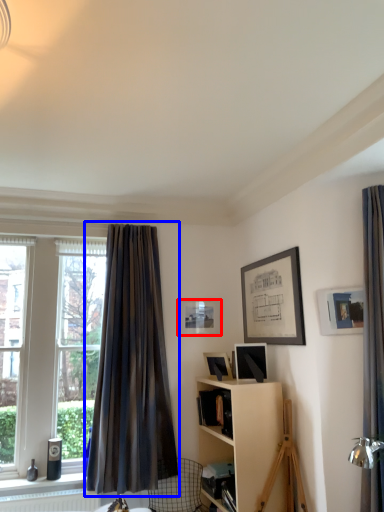
Question: Which object appears closest to the camera in this image, picture frame (highlighted by a red box) or curtain (highlighted by a blue box)?

Choices:
 (A) picture frame
 (B) curtain

Answer: (B)